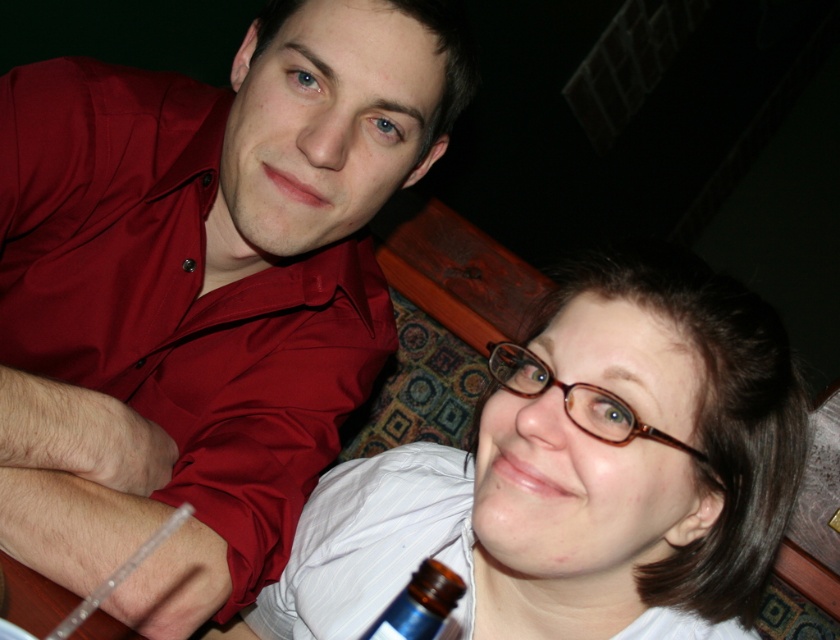
You are a photographer setting up for a group photo. You notice the shiny red shirt at upper left and the matte white shirt at lower center in your frame. Which of these two shirts should you adjust to ensure they occupy a similar amount of space in the photo?

The shiny red shirt at upper left occupies less space than the matte white shirt at lower center, so you should adjust the shiny red shirt at upper left to take up more space or reduce the space of the matte white shirt at lower center to balance them.

You are a photographer trying to capture a closeup of the shiny red shirt at upper left and the brown glass bottle at lower center. Which object is wider in the image?

The shiny red shirt at upper left is wider than the brown glass bottle at lower center according to the description.